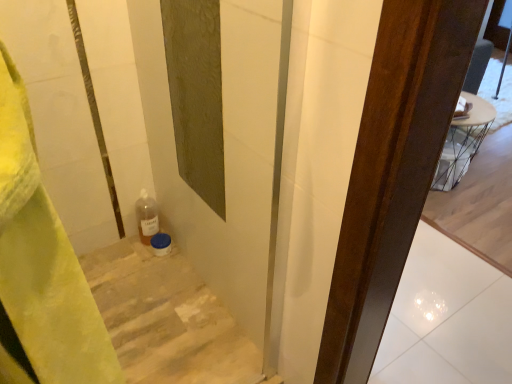
What do you see at coordinates (447, 318) in the screenshot? Image resolution: width=512 pixels, height=384 pixels. I see `white glossy tile at center` at bounding box center [447, 318].

Identify the location of white glossy tile at center. (447, 318).

This screenshot has height=384, width=512. What do you see at coordinates (166, 319) in the screenshot?
I see `wooden stairs at lower left` at bounding box center [166, 319].

Locate an element on the screen. wooden stairs at lower left is located at coordinates (166, 319).

Where is `white glossy tile at center`? The width and height of the screenshot is (512, 384). white glossy tile at center is located at coordinates (447, 318).

In the scene shown: In the image, is wooden stairs at lower left on the left side or the right side of white glossy tile at center?

wooden stairs at lower left is to the left of white glossy tile at center.

Which is in front, wooden stairs at lower left or white glossy tile at center?

wooden stairs at lower left.

Considering the positions of point (173, 321) and point (426, 362), is point (173, 321) closer or farther from the camera than point (426, 362)?

Point (173, 321) is closer to the camera than point (426, 362).

From the image's perspective, which is below, wooden stairs at lower left or white glossy tile at center?

wooden stairs at lower left, from the image's perspective.

From a real-world perspective, is wooden stairs at lower left located beneath white glossy tile at center?

No, from a real-world perspective, wooden stairs at lower left is not under white glossy tile at center.

Looking at their sizes, would you say wooden stairs at lower left is wider or thinner than white glossy tile at center?

wooden stairs at lower left is thinner than white glossy tile at center.

Is wooden stairs at lower left taller or shorter than white glossy tile at center?

In the image, wooden stairs at lower left appears to be taller than white glossy tile at center.

Which of these two, wooden stairs at lower left or white glossy tile at center, is smaller?

With smaller size is white glossy tile at center.

Is wooden stairs at lower left positioned beyond the bounds of white glossy tile at center?

Yes.

Is wooden stairs at lower left positioned far away from white glossy tile at center?

That's not correct — wooden stairs at lower left is a little close to white glossy tile at center.

Is white glossy tile at center at the back of wooden stairs at lower left?

No, wooden stairs at lower left is not facing the opposite direction of white glossy tile at center.

How much distance is there between wooden stairs at lower left and white glossy tile at center?

The distance of wooden stairs at lower left from white glossy tile at center is 33.61 inches.

At what (x,y) coordinates should I click in order to perform the action: click on tile above the wooden stairs at lower left (from the image's perspective). Please return your answer as a coordinate pair (x, y). This screenshot has height=384, width=512. Looking at the image, I should click on (447, 318).

Which object is positioned more to the right, white glossy tile at center or wooden stairs at lower left?

Positioned to the right is white glossy tile at center.

Is the depth of white glossy tile at center greater than that of wooden stairs at lower left?

Yes.

Which is further, (390, 373) or (115, 273)?

The point (115, 273) is more distant.

From the image's perspective, is white glossy tile at center located beneath wooden stairs at lower left?

No.

From a real-world perspective, is white glossy tile at center beneath wooden stairs at lower left?

Yes, from a real-world perspective, white glossy tile at center is beneath wooden stairs at lower left.

Considering the relative sizes of white glossy tile at center and wooden stairs at lower left in the image provided, is white glossy tile at center thinner than wooden stairs at lower left?

Result: Incorrect, the width of white glossy tile at center is not less than that of wooden stairs at lower left.

Is white glossy tile at center taller than wooden stairs at lower left?

Incorrect, the height of white glossy tile at center is not larger of that of wooden stairs at lower left.

Is white glossy tile at center smaller than wooden stairs at lower left?

Correct, white glossy tile at center occupies less space than wooden stairs at lower left.

Is white glossy tile at center outside of wooden stairs at lower left?

Yes, white glossy tile at center is located beyond the bounds of wooden stairs at lower left.

Is white glossy tile at center positioned far away from wooden stairs at lower left?

No, white glossy tile at center is not far from wooden stairs at lower left.

Is white glossy tile at center positioned with its back to wooden stairs at lower left?

white glossy tile at center is not turned away from wooden stairs at lower left.

Image resolution: width=512 pixels, height=384 pixels. In the image, there is a wooden stairs at lower left. Find the location of `tile above it (from the image's perspective)`. tile above it (from the image's perspective) is located at coordinates (447, 318).

The image size is (512, 384). I want to click on stairs that appears above the white glossy tile at center (from a real-world perspective), so click(166, 319).

Image resolution: width=512 pixels, height=384 pixels. I want to click on tile to the right of wooden stairs at lower left, so click(x=447, y=318).